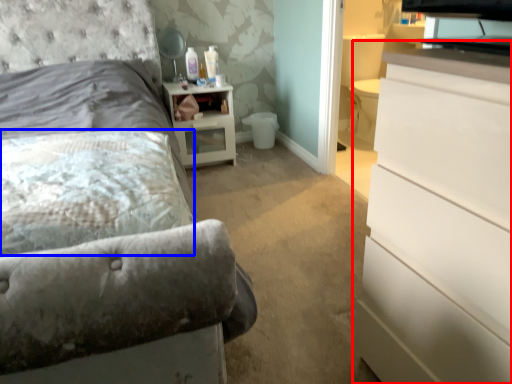
Question: Which object is closer to the camera taking this photo, chest of drawers (highlighted by a red box) or pillow (highlighted by a blue box)?

Choices:
 (A) chest of drawers
 (B) pillow

Answer: (A)